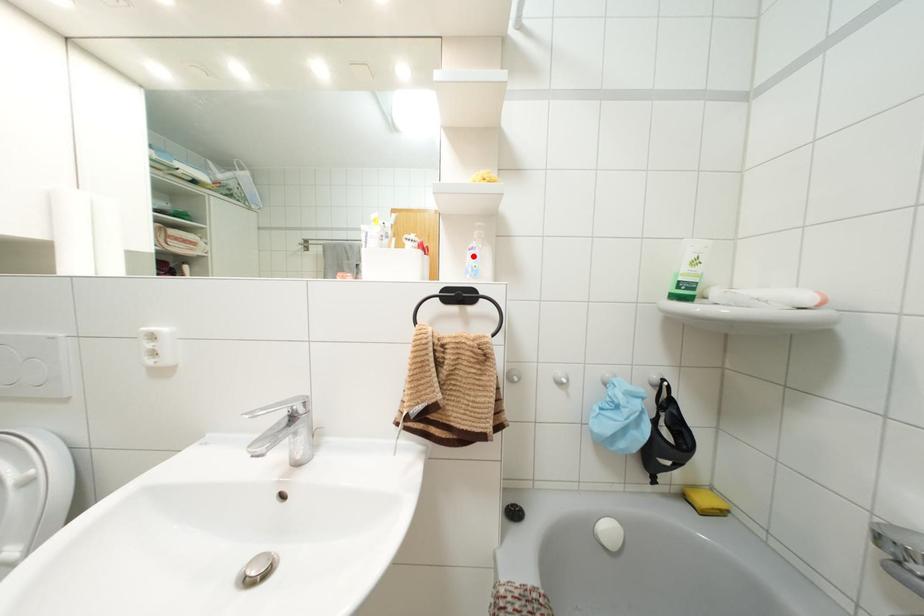
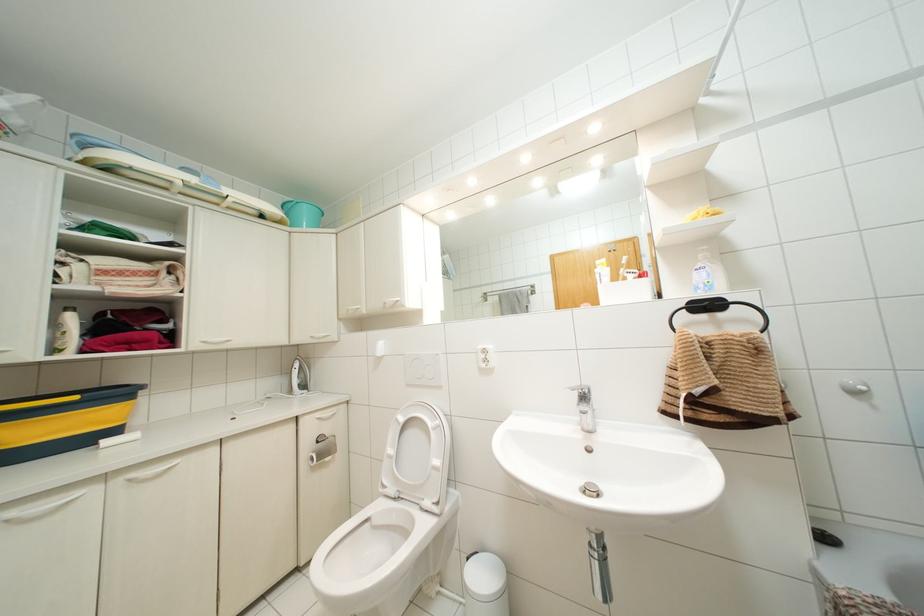
Locate, in the second image, the point that corresponds to the highlighted location in the first image.

(703, 274)